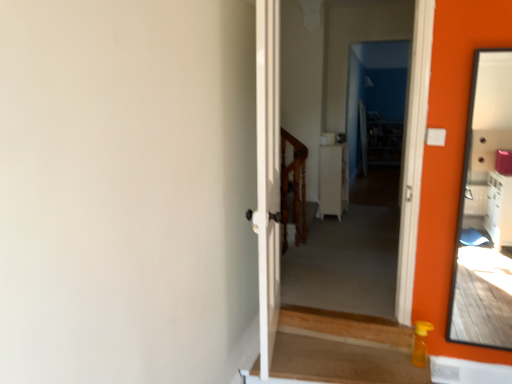
Question: Do you think matte orange mirror at right is within white glossy cabinet at center, or outside of it?

Choices:
 (A) outside
 (B) inside

Answer: (A)

Question: Considering the relative positions of matte orange mirror at right and white glossy cabinet at center in the image provided, is matte orange mirror at right to the left or to the right of white glossy cabinet at center?

Choices:
 (A) left
 (B) right

Answer: (B)

Question: Estimate the real-world distances between objects in this image. Which object is closer to the white glossy cabinet at center?

Choices:
 (A) wooden at center
 (B) matte orange mirror at right

Answer: (A)

Question: Considering the real-world distances, which object is farthest from the wooden at center?

Choices:
 (A) matte orange mirror at right
 (B) white glossy cabinet at center

Answer: (A)